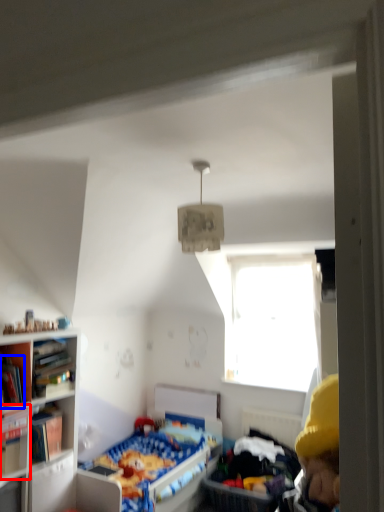
Question: Which object is closer to the camera taking this photo, book (highlighted by a red box) or book (highlighted by a blue box)?

Choices:
 (A) book
 (B) book

Answer: (A)